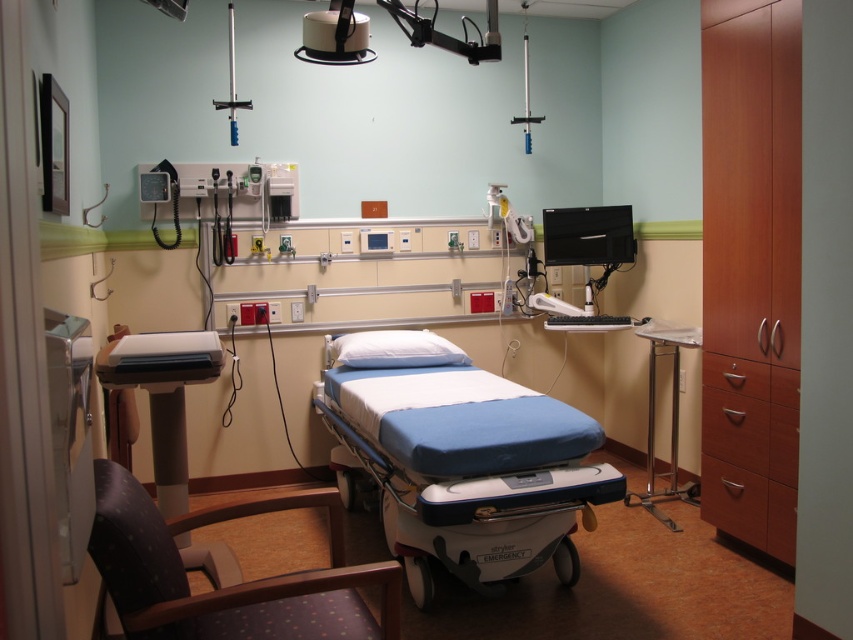
Question: Can you confirm if wooden drawer at lower right is positioned to the left of satin silver monitor at upper right?

Choices:
 (A) no
 (B) yes

Answer: (A)

Question: Does blue fabric bed at center appear on the right side of dark brown fabric chair at lower left?

Choices:
 (A) no
 (B) yes

Answer: (B)

Question: Which object appears farthest from the camera in this image?

Choices:
 (A) satin silver monitor at upper right
 (B) white soft pillow at center
 (C) blue fabric bed at center

Answer: (A)

Question: Which object is farther from the camera taking this photo?

Choices:
 (A) satin silver monitor at upper right
 (B) silver metallic stand at right
 (C) dark brown fabric chair at lower left
 (D) white soft pillow at center

Answer: (A)

Question: Among these objects, which one is nearest to the camera?

Choices:
 (A) white soft pillow at center
 (B) satin silver monitor at upper right

Answer: (A)

Question: From the image, what is the correct spatial relationship of dark brown fabric chair at lower left in relation to brown wood drawer at right?

Choices:
 (A) below
 (B) above

Answer: (A)